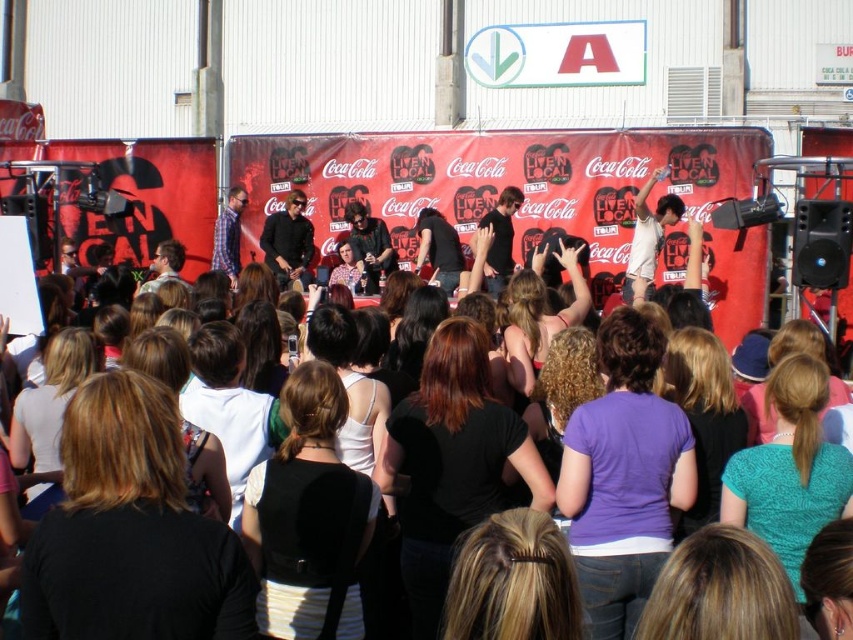
You are a photographer at the event and want to ensure both the matte black shirt at center and the black leather jacket at center are visible in your photo. Considering their sizes, which one might you need to adjust your camera angle to capture fully?

The matte black shirt at center is much taller than the black leather jacket at center, so you might need to adjust your camera angle to ensure the taller matte black shirt at center is fully captured in the photo.

You are standing at the stage of the event and want to take a photo of both point (262, 250) and point (236, 236). Which point should you focus on first to ensure both are in clear view?

You should focus on point (262, 250) first because it is closer to the camera than point (236, 236), ensuring both points are in focus when using depth of field.

You are a photographer at the event and want to capture both the matte black shirt at center and the plaid shirt at center in a single shot. Which shirt should you focus on first to ensure both are in frame?

The matte black shirt at center is positioned under the plaid shirt at center, so focusing on the plaid shirt at center first will allow the matte black shirt at center to be captured below it in the frame.